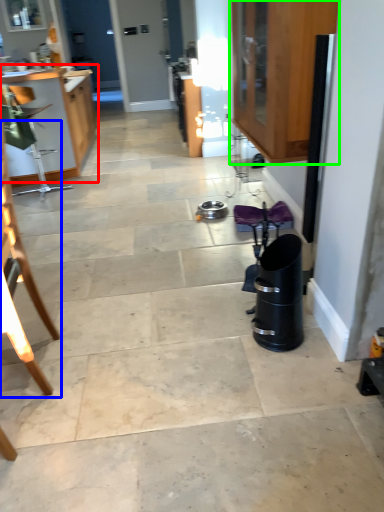
Question: Which object is the farthest from cabinetry (highlighted by a red box)? Choose among these: chair (highlighted by a blue box) or cabinetry (highlighted by a green box).

Choices:
 (A) chair
 (B) cabinetry

Answer: (A)